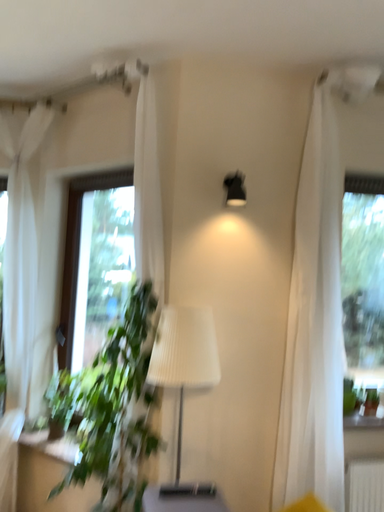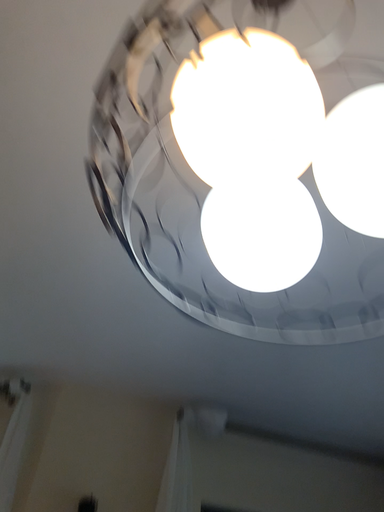
Question: Which way did the camera rotate in the video?

Choices:
 (A) rotated right
 (B) rotated left

Answer: (A)